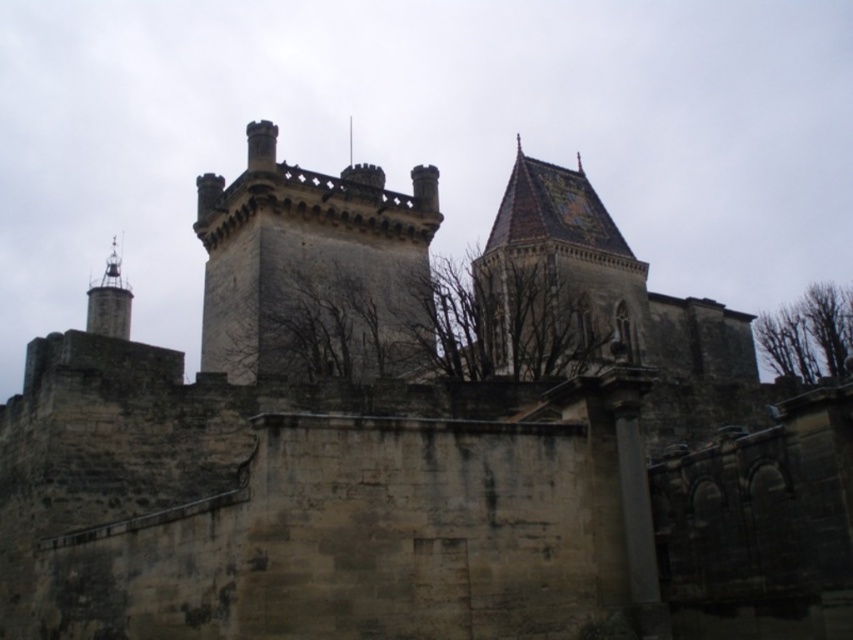
You are an architect examining the historic stone structure. From your vantage point, can you see the bare branches at upper right behind the brown tiled roof at upper center?

The brown tiled roof at upper center is in front of bare branches at upper right, so the bare branches at upper right cannot be seen behind the brown tiled roof at upper center from this vantage point.

You are a bird looking for a nesting spot. You see the bare branches at center and the brown tiled roof at upper center. Which location is closer to the ground?

The brown tiled roof at upper center is higher than the bare branches at center, so the bare branches at center are closer to the ground.

You are an architect examining the historic stone structure. You notice the brown tiled roof at upper center and the bare branches at upper right. Which of these two features is positioned further to the east?

The brown tiled roof at upper center is to the left of bare branches at upper right. Since the image is viewed from a standard perspective where left corresponds to east, the brown tiled roof at upper center is positioned further to the east.